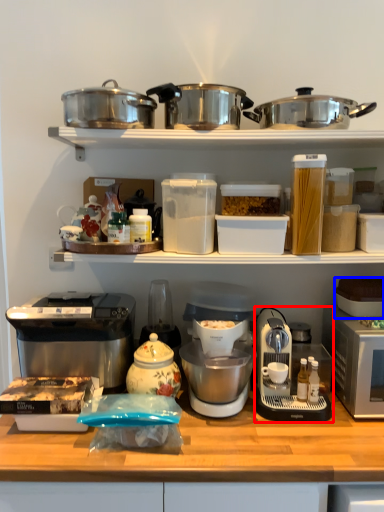
Question: Which object appears farthest to the camera in this image, coffee maker (highlighted by a red box) or appliance (highlighted by a blue box)?

Choices:
 (A) coffee maker
 (B) appliance

Answer: (B)